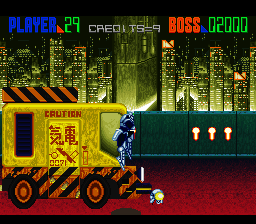
This screenshot has height=224, width=256. I want to click on floor, so click(198, 206).